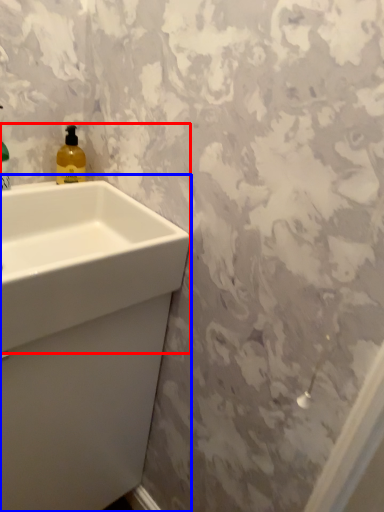
Question: Which of the following is the farthest to the observer, sink (highlighted by a red box) or sink (highlighted by a blue box)?

Choices:
 (A) sink
 (B) sink

Answer: (B)